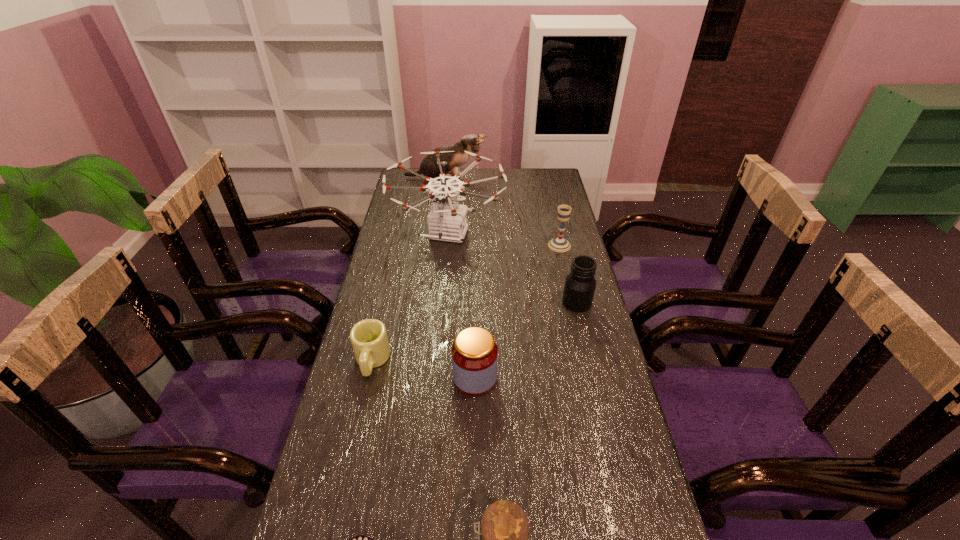
At what (x,y) coordinates should I click in order to perform the action: click on object at the far left corner. Please return your answer as a coordinate pair (x, y). Looking at the image, I should click on (471, 143).

In the image, there is a desktop. Find the location of `vacant space at the far edge`. vacant space at the far edge is located at coordinates (494, 170).

Where is `vacant space at the left edge of the desktop`? vacant space at the left edge of the desktop is located at coordinates (359, 387).

In the image, there is a desktop. Where is `free space at the right edge`? The image size is (960, 540). free space at the right edge is located at coordinates (598, 480).

I want to click on free space between the second nearest jar and the fourth farthest object, so click(x=526, y=340).

I want to click on free space between the chalice and the tallest object, so click(x=504, y=240).

This screenshot has height=540, width=960. I want to click on free space that is in between the fifth nearest object and the second farthest jar, so click(526, 340).

Where is `free space between the second farthest jar and the fourth farthest object`? The height and width of the screenshot is (540, 960). free space between the second farthest jar and the fourth farthest object is located at coordinates (526, 340).

Locate an element on the screen. empty location between the rightmost jar and the second farthest jar is located at coordinates (526, 340).

Locate an element on the screen. The height and width of the screenshot is (540, 960). the third closest object relative to the fifth nearest object is located at coordinates click(474, 353).